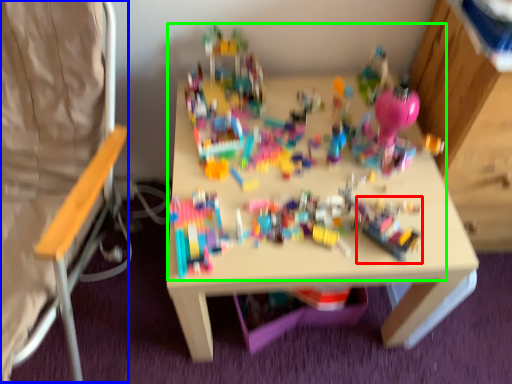
Question: Estimate the real-world distances between objects in this image. Which object is closer to toy (highlighted by a red box), folding chair (highlighted by a blue box) or toy (highlighted by a green box)?

Choices:
 (A) folding chair
 (B) toy

Answer: (B)